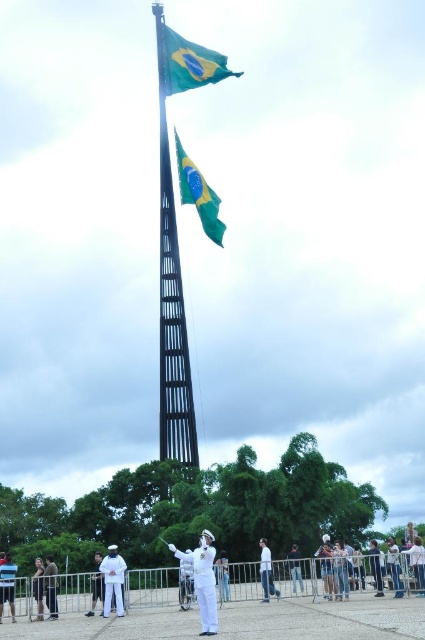
You are a photographer standing at point (203,579). You want to take a picture of the two Brazilian flags on the flagpole. Where should you position yourself to capture both flags in the frame?

The white matte uniform at center is located at point (203,579). To capture both Brazilian flags on the flagpole, you should position yourself at the white matte uniform at center, as this central position allows for a clear view of both flags.